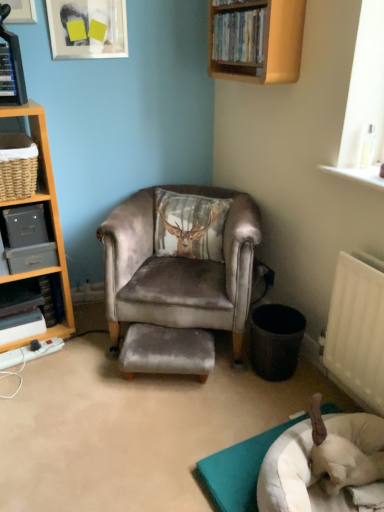
I want to click on vacant space that is in between black plastic trash can at lower right and white fabric dog bed at lower right, so click(262, 403).